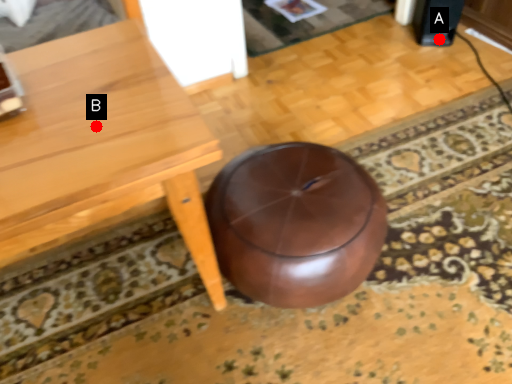
Question: Two points are circled on the image, labeled by A and B beside each circle. Which point is farther to the camera?

Choices:
 (A) A is further
 (B) B is further

Answer: (A)